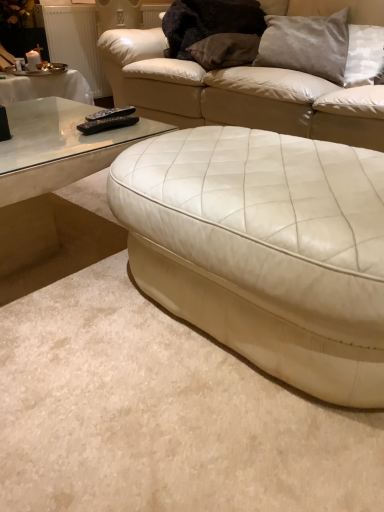
How much space does black plastic remote at left, positioned as the 2th remote in front-to-back order, occupy vertically?

The height of black plastic remote at left, positioned as the 2th remote in front-to-back order, is 1.70 inches.

This screenshot has width=384, height=512. What do you see at coordinates (111, 113) in the screenshot?
I see `black plastic remote at left, positioned as the 2th remote in front-to-back order` at bounding box center [111, 113].

The width and height of the screenshot is (384, 512). What do you see at coordinates (306, 45) in the screenshot?
I see `satin gray pillow at upper right, positioned as the 2th pillow in left-to-right order` at bounding box center [306, 45].

This screenshot has width=384, height=512. I want to click on satin gray pillow at upper right, positioned as the 2th pillow in left-to-right order, so click(x=306, y=45).

What do you see at coordinates (237, 94) in the screenshot? I see `white leather studio couch at center, the 1th studio couch from the back` at bounding box center [237, 94].

I want to click on transparent glass coffee table at left, so click(49, 170).

What do you see at coordinates (225, 50) in the screenshot? I see `suede-like brown pillow at upper center, positioned as the 2th pillow in right-to-left order` at bounding box center [225, 50].

Measure the distance between point (206, 42) and camera.

The depth of point (206, 42) is 6.84 feet.

Identify the location of black plastic remote at left, positioned as the 2th remote in front-to-back order. (111, 113).

Does suede-like brown pillow at upper center, positioned as the 2th pillow in right-to-left order, have a smaller size compared to satin gray pillow at upper right, positioned as the 2th pillow in left-to-right order?

Yes.

From a real-world perspective, is suede-like brown pillow at upper center, placed as the first pillow when sorted from left to right, located beneath satin gray pillow at upper right, positioned as the 2th pillow in left-to-right order?

Yes, from a real-world perspective, suede-like brown pillow at upper center, placed as the first pillow when sorted from left to right, is under satin gray pillow at upper right, positioned as the 2th pillow in left-to-right order.

From the picture: Does suede-like brown pillow at upper center, placed as the first pillow when sorted from left to right, have a greater width compared to satin gray pillow at upper right, positioned as the 2th pillow in left-to-right order?

Indeed, suede-like brown pillow at upper center, placed as the first pillow when sorted from left to right, has a greater width compared to satin gray pillow at upper right, positioned as the 2th pillow in left-to-right order.

From the image's perspective, is suede-like brown pillow at upper center, placed as the first pillow when sorted from left to right, beneath satin gray pillow at upper right, positioned as the 2th pillow in left-to-right order?

Indeed, from the image's perspective, suede-like brown pillow at upper center, placed as the first pillow when sorted from left to right, is shown beneath satin gray pillow at upper right, positioned as the 2th pillow in left-to-right order.

Which is closer, (x=176, y=109) or (x=343, y=290)?

Point (x=343, y=290)

In order to click on studio couch lying above the white leather ottoman at center, which appears as the second studio couch when viewed from the back (from the image's perspective) in this screenshot , I will do `click(237, 94)`.

Looking at this image, do you think white leather studio couch at center, the 1th studio couch from the back, is within white leather ottoman at center, which is the first studio couch in front-to-back order, or outside of it?

white leather studio couch at center, the 1th studio couch from the back, is outside white leather ottoman at center, which is the first studio couch in front-to-back order.

Is white leather studio couch at center, the 1th studio couch from the back, oriented towards white leather ottoman at center, which is the first studio couch in front-to-back order?

Yes, white leather studio couch at center, the 1th studio couch from the back, faces towards white leather ottoman at center, which is the first studio couch in front-to-back order.

Locate an element on the screen. Image resolution: width=384 pixels, height=512 pixels. remote that is the 1st one above the white leather ottoman at center, which appears as the second studio couch when viewed from the back (from a real-world perspective) is located at coordinates (111, 113).

Which is correct: black plastic remote at left, positioned as the 2th remote in front-to-back order, is inside white leather ottoman at center, which is the first studio couch in front-to-back order, or outside of it?

black plastic remote at left, positioned as the 2th remote in front-to-back order, is located beyond the bounds of white leather ottoman at center, which is the first studio couch in front-to-back order.

Considering the sizes of objects black plastic remote at left, positioned as the 2th remote in front-to-back order, and white leather ottoman at center, which is the first studio couch in front-to-back order, in the image provided, who is bigger, black plastic remote at left, positioned as the 2th remote in front-to-back order, or white leather ottoman at center, which is the first studio couch in front-to-back order,?

Bigger between the two is white leather ottoman at center, which is the first studio couch in front-to-back order.

Are black plastic remote at left, positioned as the 2th remote in front-to-back order, and white leather ottoman at center, which is the first studio couch in front-to-back order, located far from each other?

No, black plastic remote at left, positioned as the 2th remote in front-to-back order, is not far from white leather ottoman at center, which is the first studio couch in front-to-back order.

Which is in front, black plastic remote at left, the 1th remote positioned from the front, or satin gray pillow at upper right, which is counted as the 1th pillow, starting from the right?

Positioned in front is black plastic remote at left, the 1th remote positioned from the front.

Which is more to the left, black plastic remote at left, the 1th remote positioned from the front, or satin gray pillow at upper right, positioned as the 2th pillow in left-to-right order?

black plastic remote at left, the 1th remote positioned from the front, is more to the left.

From a real-world perspective, is black plastic remote at left, which is the second remote in back-to-front order, physically located above or below satin gray pillow at upper right, positioned as the 2th pillow in left-to-right order?

Clearly, from a real-world perspective, black plastic remote at left, which is the second remote in back-to-front order, is below satin gray pillow at upper right, positioned as the 2th pillow in left-to-right order.

In the scene shown: Between black plastic remote at left, which appears as the 1th remote when viewed from the back, and white leather studio couch at center, which is the second studio couch in front-to-back order, which one has less height?

black plastic remote at left, which appears as the 1th remote when viewed from the back, is shorter.

From the image's perspective, relative to white leather studio couch at center, which is the second studio couch in front-to-back order, is black plastic remote at left, which appears as the 1th remote when viewed from the back, above or below?

From the image's perspective, black plastic remote at left, which appears as the 1th remote when viewed from the back, appears below white leather studio couch at center, which is the second studio couch in front-to-back order.

Measure the distance between black plastic remote at left, which appears as the 1th remote when viewed from the back, and white leather studio couch at center, the 1th studio couch from the back.

black plastic remote at left, which appears as the 1th remote when viewed from the back, is 29.56 inches from white leather studio couch at center, the 1th studio couch from the back.

From a real-world perspective, between black plastic remote at left, positioned as the 2th remote in front-to-back order, and white leather studio couch at center, the 1th studio couch from the back, who is vertically higher?

black plastic remote at left, positioned as the 2th remote in front-to-back order, from a real-world perspective.

Measure the distance between white leather ottoman at center, which appears as the second studio couch when viewed from the back, and black plastic remote at left, which is the second remote in back-to-front order.

26.80 inches.

From a real-world perspective, which object rests below the other?

white leather ottoman at center, which is the first studio couch in front-to-back order.

Does white leather ottoman at center, which appears as the second studio couch when viewed from the back, have a lesser width compared to black plastic remote at left, which is the second remote in back-to-front order?

Incorrect, the width of white leather ottoman at center, which appears as the second studio couch when viewed from the back, is not less than that of black plastic remote at left, which is the second remote in back-to-front order.

How many degrees apart are the facing directions of white leather ottoman at center, which appears as the second studio couch when viewed from the back, and black plastic remote at left, the 1th remote positioned from the front?

There is a 90-degree angle between the facing directions of white leather ottoman at center, which appears as the second studio couch when viewed from the back, and black plastic remote at left, the 1th remote positioned from the front.

Considering the sizes of objects black plastic remote at left, which is the second remote in back-to-front order, and white leather ottoman at center, which appears as the second studio couch when viewed from the back, in the image provided, who is smaller, black plastic remote at left, which is the second remote in back-to-front order, or white leather ottoman at center, which appears as the second studio couch when viewed from the back,?

Smaller between the two is black plastic remote at left, which is the second remote in back-to-front order.

From the image's perspective, is black plastic remote at left, which is the second remote in back-to-front order, below white leather ottoman at center, which is the first studio couch in front-to-back order?

No.

Considering the positions of point (86, 131) and point (217, 275), is point (86, 131) closer or farther from the camera than point (217, 275)?

Clearly, point (86, 131) is more distant from the camera than point (217, 275).

Can you confirm if black plastic remote at left, the 1th remote positioned from the front, is wider than white leather ottoman at center, which is the first studio couch in front-to-back order?

No.

Find the location of a particular element. This screenshot has width=384, height=512. pillow below the satin gray pillow at upper right, which is counted as the 1th pillow, starting from the right (from the image's perspective) is located at coordinates (225, 50).

You are a GUI agent. You are given a task and a screenshot of the screen. Output one action in this format:
    pyautogui.click(x=<x>, y=<y>)
    Task: Click on the studio couch above the white leather ottoman at center, which appears as the second studio couch when viewed from the back (from a real-world perspective)
    This screenshot has width=384, height=512.
    Given the screenshot: What is the action you would take?
    pyautogui.click(x=237, y=94)

Based on the photo, when comparing their distances from satin gray pillow at upper right, which is counted as the 1th pillow, starting from the right, does suede-like brown pillow at upper center, placed as the first pillow when sorted from left to right, or black plastic remote at left, which is the second remote in back-to-front order, seem closer?

suede-like brown pillow at upper center, placed as the first pillow when sorted from left to right.

Looking at this image, considering their positions, is black plastic remote at left, which appears as the 1th remote when viewed from the back, positioned further to white leather studio couch at center, which is the second studio couch in front-to-back order, than black plastic remote at left, the 1th remote positioned from the front?

The object further to white leather studio couch at center, which is the second studio couch in front-to-back order, is black plastic remote at left, the 1th remote positioned from the front.

Looking at this image, from the image, which object appears to be nearer to black plastic remote at left, which appears as the 1th remote when viewed from the back, white leather ottoman at center, which appears as the second studio couch when viewed from the back, or white leather studio couch at center, the 1th studio couch from the back?

white leather studio couch at center, the 1th studio couch from the back, is positioned closer to the anchor black plastic remote at left, which appears as the 1th remote when viewed from the back.

Considering their positions, is transparent glass coffee table at left positioned further to black plastic remote at left, which is the second remote in back-to-front order, than satin gray pillow at upper right, which is counted as the 1th pillow, starting from the right?

Based on the image, satin gray pillow at upper right, which is counted as the 1th pillow, starting from the right, appears to be further to black plastic remote at left, which is the second remote in back-to-front order.

Which object lies nearer to the anchor point black plastic remote at left, which appears as the 1th remote when viewed from the back, white leather studio couch at center, the 1th studio couch from the back, or suede-like brown pillow at upper center, positioned as the 2th pillow in right-to-left order?

white leather studio couch at center, the 1th studio couch from the back, lies closer to black plastic remote at left, which appears as the 1th remote when viewed from the back, than the other object.

Which object lies nearer to the anchor point black plastic remote at left, which appears as the 1th remote when viewed from the back, black plastic remote at left, the 1th remote positioned from the front, or suede-like brown pillow at upper center, placed as the first pillow when sorted from left to right?

The object closer to black plastic remote at left, which appears as the 1th remote when viewed from the back, is black plastic remote at left, the 1th remote positioned from the front.

Considering their positions, is white leather studio couch at center, the 1th studio couch from the back, positioned further to black plastic remote at left, which is the second remote in back-to-front order, than satin gray pillow at upper right, positioned as the 2th pillow in left-to-right order?

The object further to black plastic remote at left, which is the second remote in back-to-front order, is satin gray pillow at upper right, positioned as the 2th pillow in left-to-right order.

Which object lies nearer to the anchor point satin gray pillow at upper right, which is counted as the 1th pillow, starting from the right, white leather ottoman at center, which appears as the second studio couch when viewed from the back, or white leather studio couch at center, the 1th studio couch from the back?

white leather studio couch at center, the 1th studio couch from the back.

You are a GUI agent. You are given a task and a screenshot of the screen. Output one action in this format:
    pyautogui.click(x=<x>, y=<y>)
    Task: Click on the pillow between white leather studio couch at center, which is the second studio couch in front-to-back order, and suede-like brown pillow at upper center, placed as the first pillow when sorted from left to right, along the z-axis
    This screenshot has height=512, width=384.
    Given the screenshot: What is the action you would take?
    pyautogui.click(x=306, y=45)

Find the location of a particular element. studio couch located between white leather ottoman at center, which appears as the second studio couch when viewed from the back, and satin gray pillow at upper right, which is counted as the 1th pillow, starting from the right, in the depth direction is located at coordinates (237, 94).

The image size is (384, 512). What are the coordinates of `studio couch between white leather ottoman at center, which appears as the second studio couch when viewed from the back, and suede-like brown pillow at upper center, positioned as the 2th pillow in right-to-left order, along the z-axis` in the screenshot? It's located at (237, 94).

The image size is (384, 512). What are the coordinates of `coffee table between white leather ottoman at center, which appears as the second studio couch when viewed from the back, and suede-like brown pillow at upper center, placed as the first pillow when sorted from left to right, from front to back` in the screenshot? It's located at (49, 170).